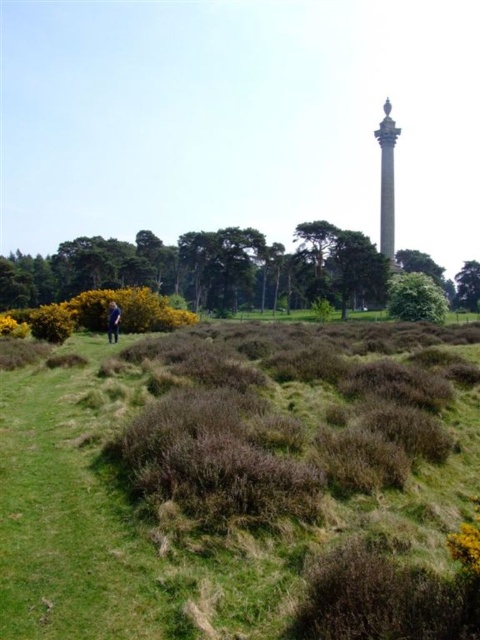
Does green grass at center have a greater width compared to green leafy tree at lower left?

Incorrect, green grass at center's width does not surpass green leafy tree at lower left's.

Which of these two, green grass at center or green leafy tree at lower left, stands taller?

green leafy tree at lower left is taller.

Is point (468, 480) farther from camera compared to point (312, 273)?

That is False.

The image size is (480, 640). Find the location of `green grass at center`. green grass at center is located at coordinates 224,474.

Between smooth gray column at upper right and blue denim jeans at lower left, which one appears on the right side from the viewer's perspective?

smooth gray column at upper right is more to the right.

Does smooth gray column at upper right have a lesser width compared to blue denim jeans at lower left?

No.

Who is more forward, (x=391, y=131) or (x=108, y=323)?

Point (x=108, y=323) is more forward.

Identify the location of smooth gray column at upper right. pyautogui.click(x=386, y=180).

Which is behind, point (466, 260) or point (119, 317)?

Point (466, 260)

Between green leafy tree at upper right and blue denim jeans at lower left, which one is positioned lower?

blue denim jeans at lower left is lower down.

Which is behind, point (479, 285) or point (115, 314)?

The point (479, 285) is behind.

Locate an element on the screen. green leafy tree at upper right is located at coordinates (468, 285).